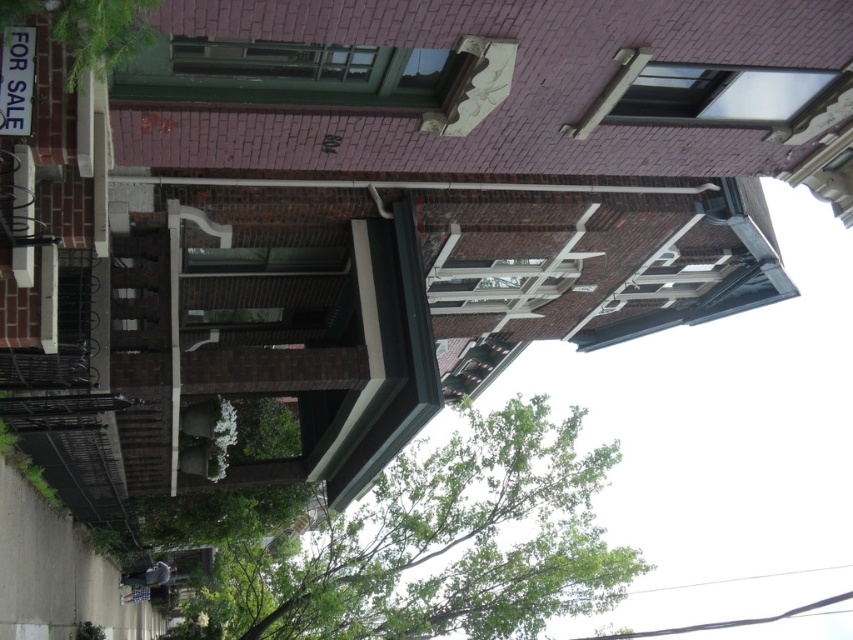
You are a real estate agent preparing to take a photo of the house. You want to ensure that both the green leafy tree at lower center and the green leafy tree at upper left are visible in the frame. Which tree will appear larger in the final photo?

The green leafy tree at lower center will appear larger in the final photo because it is bigger than the green leafy tree at upper left.

You are a delivery person trying to find the front door of the house. You see the green leafy tree at lower center and the green leafy tree at upper left. Which tree is closer to the front door?

The green leafy tree at lower center is closer to the front door because it is positioned under the green leafy tree at upper left, meaning it is in front of it.

Based on the provided scene description, what is the 2D coordinate of the green leafy tree at lower center?

The 2D coordinate of the green leafy tree at lower center is at point (x=436, y=545).